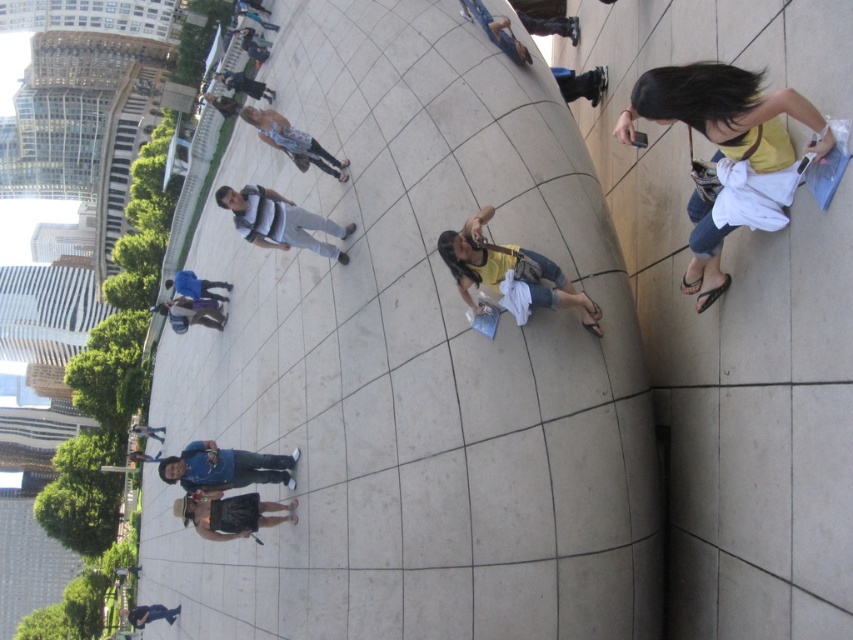
You are standing in front of the curved reflective surface and want to take a photo of the matte black camera at upper center. Considering the distance, will you need a zoom lens to capture it clearly?

The matte black camera at upper center is 60.52 meters away from the viewer. A standard lens might not be sufficient to capture it clearly at that distance, so using a zoom lens would be advisable to ensure the camera is in focus and fills the frame appropriately.

You are a photographer trying to capture a photo of the yellow cotton shirt at right and the denim shorts at lower center. Where should you position yourself to ensure both subjects are in frame?

To capture both the yellow cotton shirt at right and the denim shorts at lower center in the same frame, position yourself to the left of the denim shorts at lower center so that the yellow cotton shirt at right is to the right of the denim shorts at lower center and both are visible.